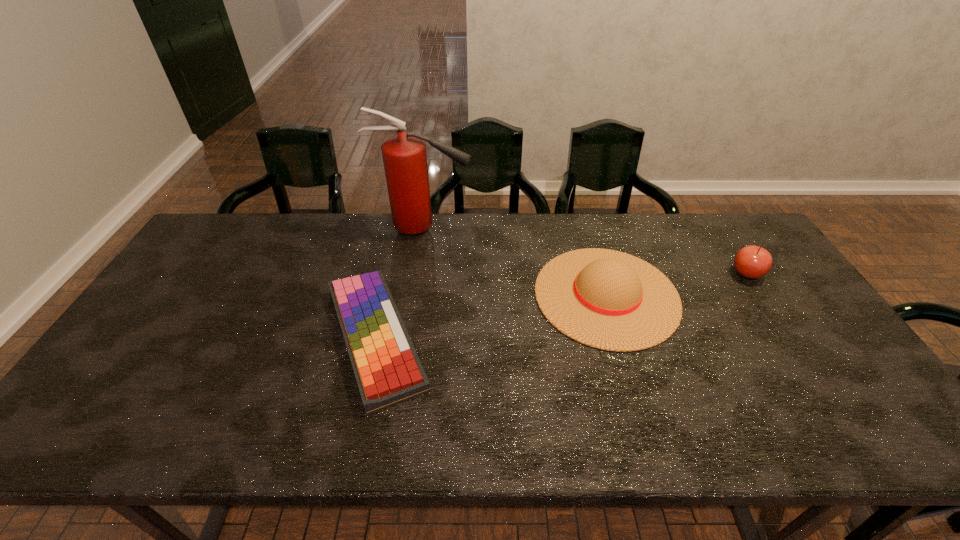
Locate an element on the screen. Image resolution: width=960 pixels, height=540 pixels. fire extinguisher is located at coordinates (404, 156).

Where is `the tallest object`? The height and width of the screenshot is (540, 960). the tallest object is located at coordinates (404, 156).

Identify the location of apple. This screenshot has width=960, height=540. (752, 262).

Locate an element on the screen. The height and width of the screenshot is (540, 960). bonnet is located at coordinates (610, 300).

At what (x,y) coordinates should I click in order to perform the action: click on computer keyboard. Please return your answer as a coordinate pair (x, y). The image size is (960, 540). Looking at the image, I should click on (387, 369).

Find the location of a particular element. vacant space located 0.120m at the nozzle of the fire extinguisher is located at coordinates (506, 228).

Find the location of `free point located on the front of the apple`. free point located on the front of the apple is located at coordinates (774, 314).

Find the location of a particular element. The height and width of the screenshot is (540, 960). vacant space situated on the right of the third object from left to right is located at coordinates (705, 295).

Where is `vacant space located on the left of the computer keyboard`? Image resolution: width=960 pixels, height=540 pixels. vacant space located on the left of the computer keyboard is located at coordinates (237, 336).

This screenshot has width=960, height=540. Find the location of `fire extinguisher present at the far edge`. fire extinguisher present at the far edge is located at coordinates (404, 156).